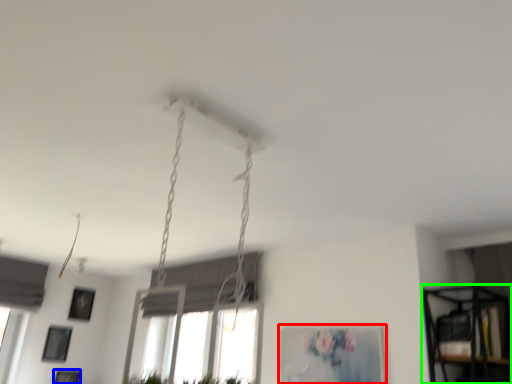
Question: Which is nearer to the picture frame (highlighted by a red box)? picture frame (highlighted by a blue box) or shelf (highlighted by a green box).

Choices:
 (A) picture frame
 (B) shelf

Answer: (B)